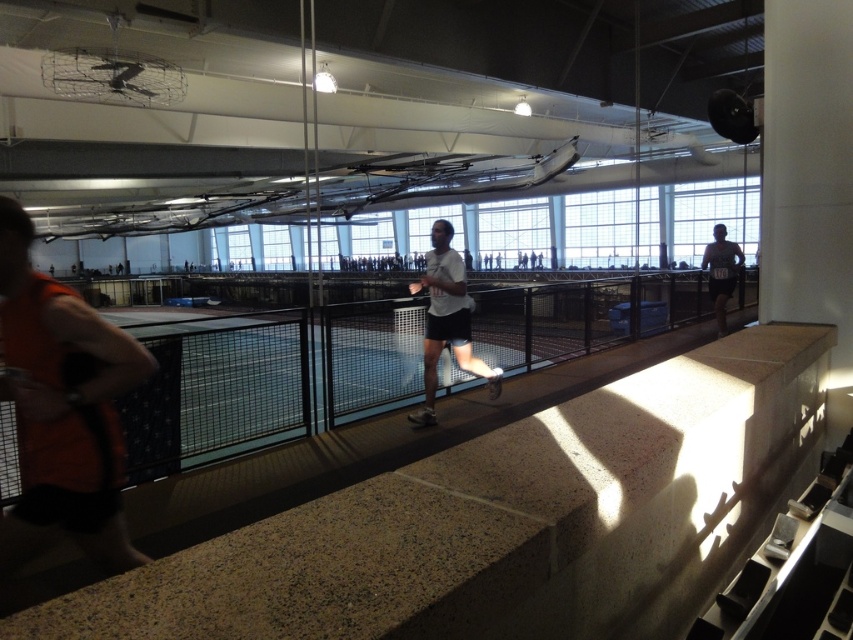
Based on the photo, between orange fabric shirt at left and white matte shorts at center, which one appears on the right side from the viewer's perspective?

white matte shorts at center is more to the right.

Is point (129, 365) positioned behind point (450, 246)?

No, (129, 365) is in front of (450, 246).

Locate an element on the screen. The width and height of the screenshot is (853, 640). orange fabric shirt at left is located at coordinates (62, 410).

Can you confirm if orange fabric shirt at left is wider than matte black shorts at right?

Yes.

Who is taller, orange fabric shirt at left or matte black shorts at right?

orange fabric shirt at left

Between point (18, 250) and point (718, 312), which one is positioned in front?

Point (18, 250) is more forward.

Locate an element on the screen. orange fabric shirt at left is located at coordinates (62, 410).

Does white matte shorts at center lie in front of matte black shorts at right?

That is True.

Is white matte shorts at center taller than matte black shorts at right?

Indeed, white matte shorts at center has a greater height compared to matte black shorts at right.

Describe the element at coordinates (447, 321) in the screenshot. This screenshot has width=853, height=640. I see `white matte shorts at center` at that location.

Where is `white matte shorts at center`? This screenshot has width=853, height=640. white matte shorts at center is located at coordinates (447, 321).